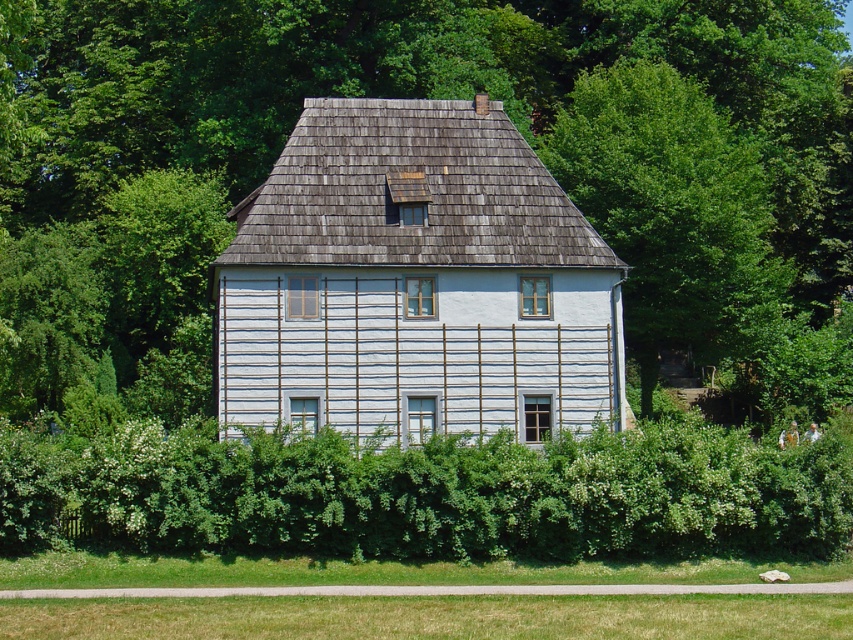
You are standing in front of the house and want to see the green leafy hedge at lower center. Is the green leafy tree at center blocking your view of it?

The green leafy tree at center is in front of green leafy hedge at lower center, so it is blocking your view of the hedge.